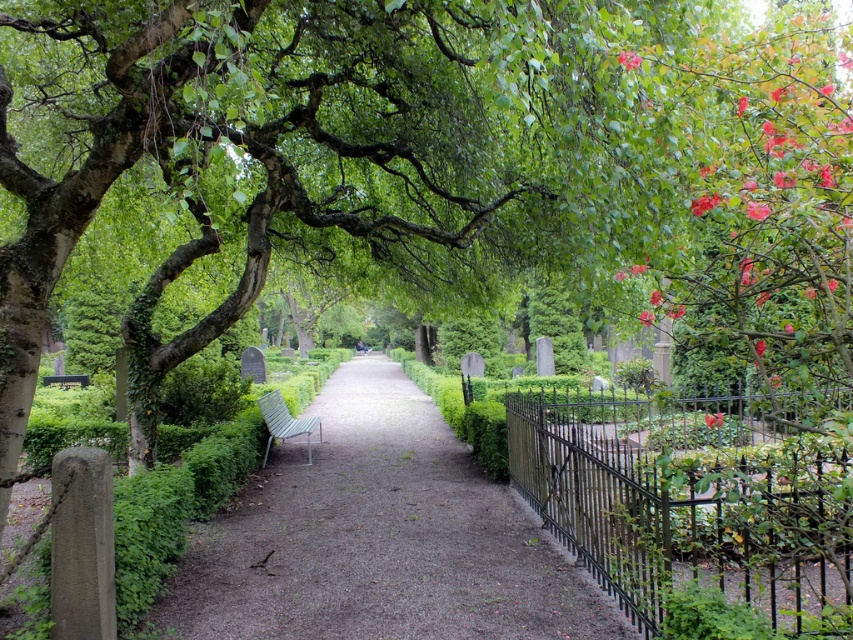
You are standing at the entrance of the garden pathway and see the point marked at coordinates (380, 538). What is located at that point?

The point marked at coordinates (380, 538) is green grass at center.

Based on the photo, you are standing at the entrance of the garden pathway and see two points marked in the image. Which point, point (479, 611) or point (274, 392), is closer to you?

Point (479, 611) is closer to the viewer than point (274, 392).

You are standing at the entrance of the garden pathway and want to sit down. You see the green grass at center and the wooden slats bench at center. Which one is closer to you?

The green grass at center is closer to you because it is in front of the wooden slats bench at center.